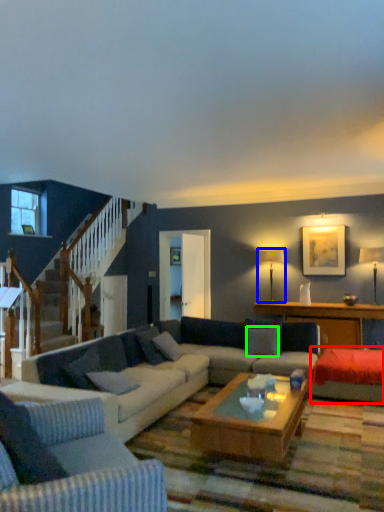
Question: Considering the real-world distances, which object is farthest from couch (highlighted by a red box)? lamp (highlighted by a blue box) or pillow (highlighted by a green box)?

Choices:
 (A) lamp
 (B) pillow

Answer: (A)